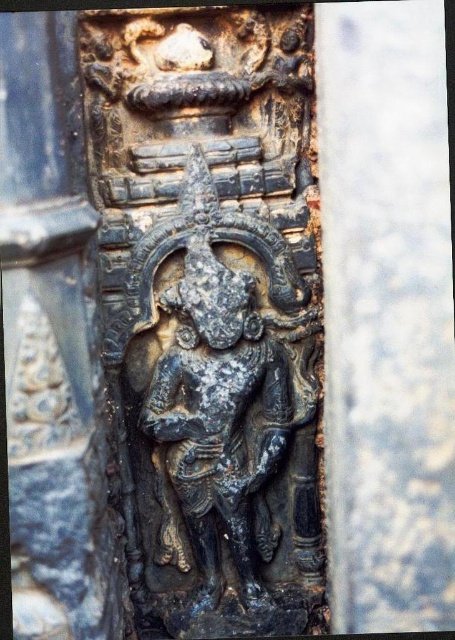
You are an archaeologist examining two stone carvings in a temple. You have a measuring tape and need to determine which one is bigger. The carvings are the black stone carving at center and the dark gray stone carving at center. Which one should you measure first if you want to find the larger one without measuring both?

The black stone carving at center is larger in size than the dark gray stone carving at center, so you should measure the black stone carving at center first to confirm its size without needing to measure the other.

You are an archaeologist examining the stone carvings in the image. You notice two objects at the center. Which one is closer to you, the black stone carving at center or the dark gray stone statue at center?

The black stone carving at center is closer to you because it is in front of the dark gray stone statue at center.

What are the coordinates of the dark gray stone carving at center?

The dark gray stone carving at center is located at coordinates point [52,346].